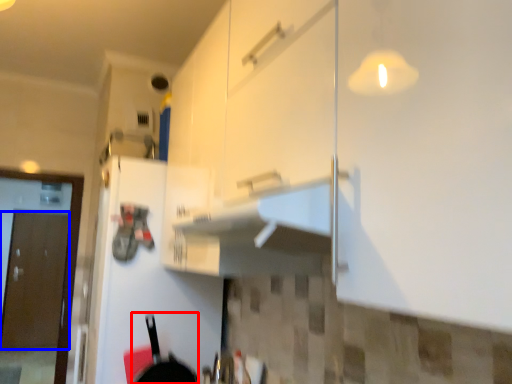
Question: Which point is further to the camera, frying pan (highlighted by a red box) or door (highlighted by a blue box)?

Choices:
 (A) frying pan
 (B) door

Answer: (B)